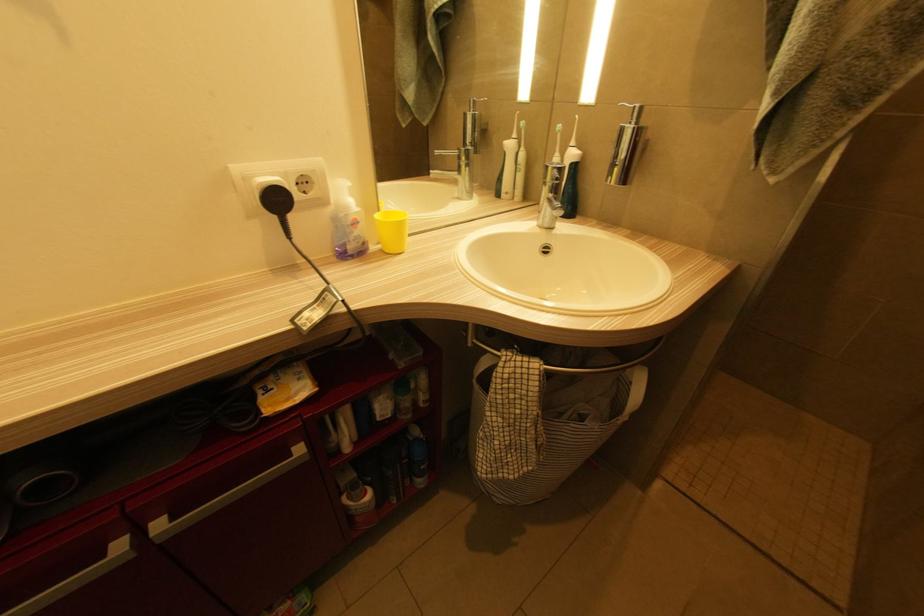
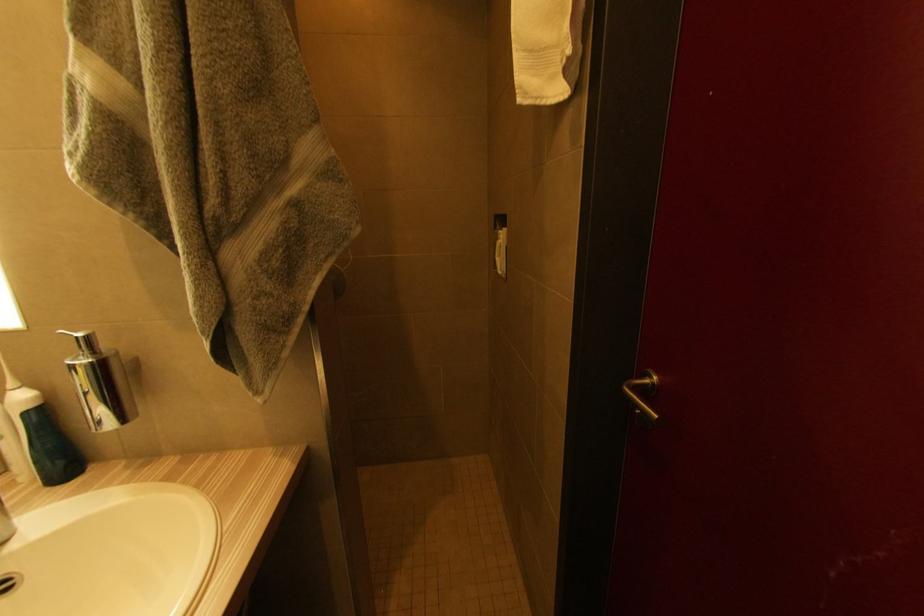
Question: The first image is from the beginning of the video and the second image is from the end. How did the camera likely rotate when shooting the video?

Choices:
 (A) Left
 (B) Right
 (C) Up
 (D) Down

Answer: (B)